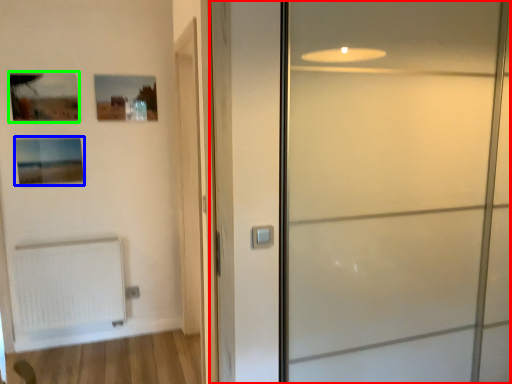
Question: Which object is positioned closest to door (highlighted by a red box)? Select from picture frame (highlighted by a blue box) and picture frame (highlighted by a green box).

Choices:
 (A) picture frame
 (B) picture frame

Answer: (A)